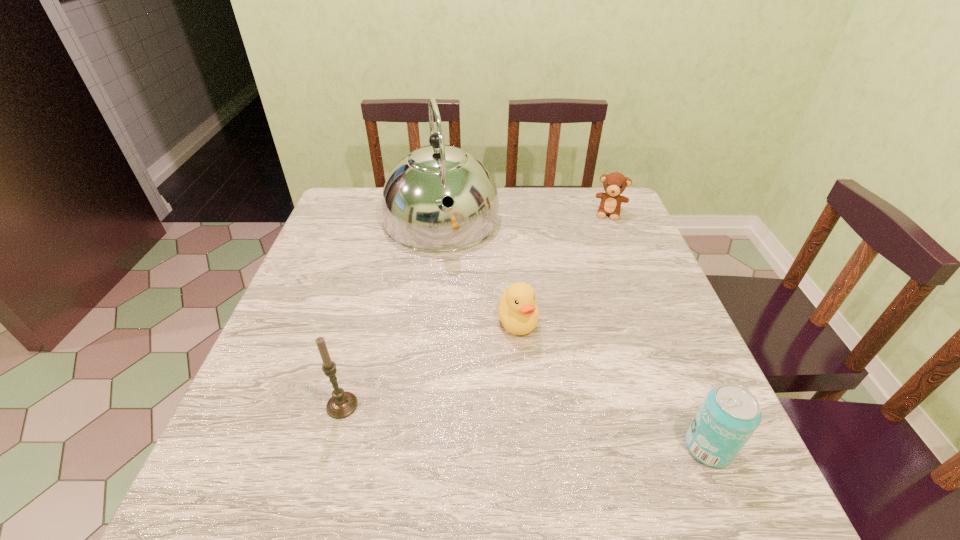
You are a GUI agent. You are given a task and a screenshot of the screen. Output one action in this format:
    pyautogui.click(x=<x>, y=<y>)
    Task: Click on the vacant space that's between the fourth shortest object and the third nearest object
    Image resolution: width=960 pixels, height=540 pixels.
    Given the screenshot: What is the action you would take?
    pyautogui.click(x=430, y=363)

Identify the location of object that is the third closest to the third nearest object. (729, 415).

Point out which object is positioned as the third nearest to the third farthest object. Please provide its 2D coordinates. Your answer should be formatted as a tuple, i.e. [(x, y)], where the tuple contains the x and y coordinates of a point satisfying the conditions above.

[(729, 415)]

Identify the location of blank area in the image that satisfies the following two spatial constraints: 1. on the front side of the beer can; 2. on the left side of the kettle. (415, 447).

I want to click on free space that satisfies the following two spatial constraints: 1. on the front side of the nearest object; 2. on the left side of the tallest object, so (x=415, y=447).